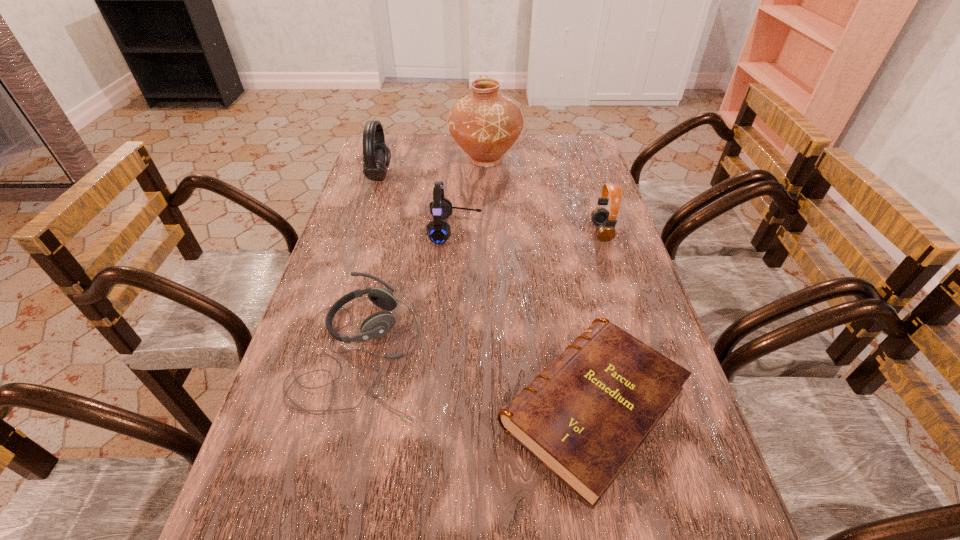
Identify the location of the tallest object. This screenshot has height=540, width=960. (485, 124).

Where is `the farthest headset`? The height and width of the screenshot is (540, 960). the farthest headset is located at coordinates (377, 155).

In order to click on the tallest headset in this screenshot , I will do `click(377, 155)`.

Image resolution: width=960 pixels, height=540 pixels. In order to click on the rightmost headset in this screenshot , I will do `click(606, 221)`.

This screenshot has height=540, width=960. I want to click on the nearest headset, so 376,325.

Locate an element on the screen. This screenshot has height=540, width=960. the shortest headset is located at coordinates (376, 325).

Find the location of `the shortest object`. the shortest object is located at coordinates (584, 417).

Find the location of a particular element. This screenshot has height=540, width=960. free spot located 0.050m on the side of the pottery with the handle is located at coordinates (485, 136).

Where is `vacant point located on the earcups of the tallest headset`? vacant point located on the earcups of the tallest headset is located at coordinates (441, 175).

Find the location of `free space located on the ear cups of the rightmost headset`. free space located on the ear cups of the rightmost headset is located at coordinates (540, 232).